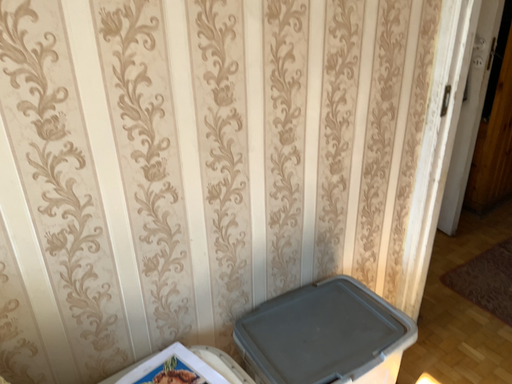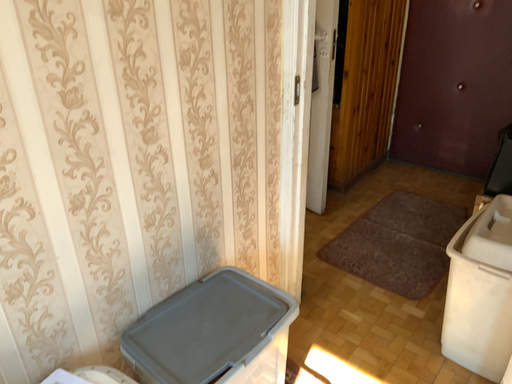
Question: How did the camera likely rotate when shooting the video?

Choices:
 (A) rotated right
 (B) rotated left

Answer: (A)